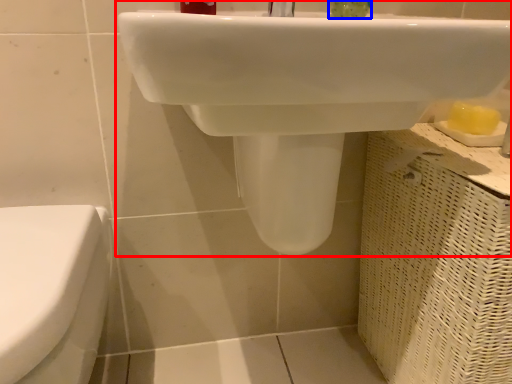
Question: Which point is further to the camera, sink (highlighted by a red box) or liquid (highlighted by a blue box)?

Choices:
 (A) sink
 (B) liquid

Answer: (B)